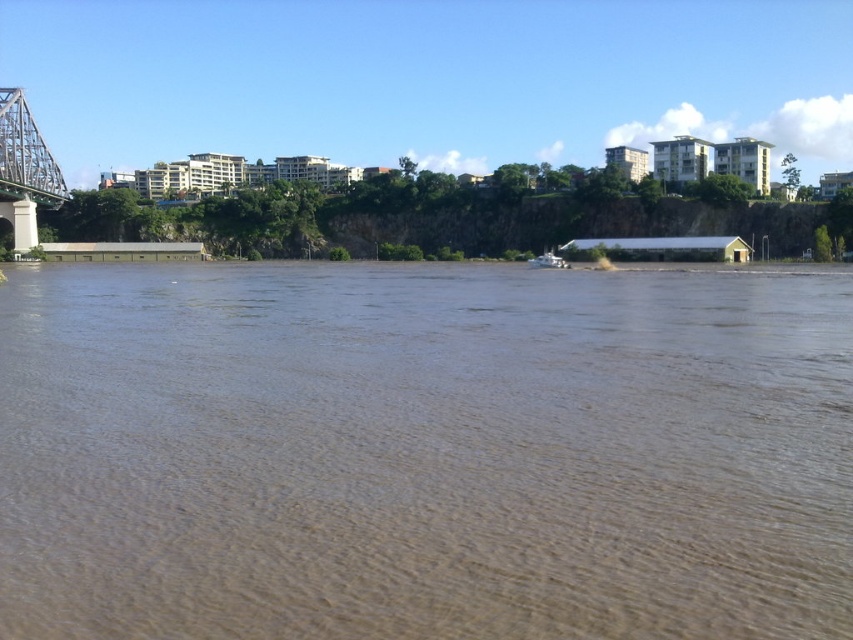
You are a photographer planning to capture the entire scene of the brown muddy water at center and the metallic steel bridge at left in one shot. Based on their sizes, which object should you focus on first to ensure both are in frame?

The brown muddy water at center has a smaller size compared to the metallic steel bridge at left, so you should focus on the metallic steel bridge at left first to ensure both fit in the frame.

You are standing at the edge of the river and see two points marked in the image. Which point, point (59, 467) or point (61, 186), is closer to you?

Point (59, 467) is closer to the viewer than point (61, 186).

You are standing on the metallic steel bridge at left and want to cross to the other side. Which direction should you look to see the brown muddy water at center?

The brown muddy water at center is to the right of the metallic steel bridge at left, so you should look to your right to see it.